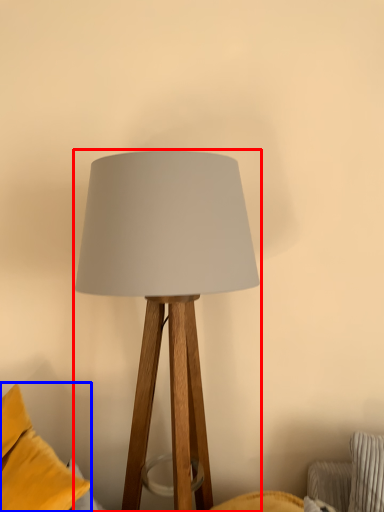
Question: Which object is closer to the camera taking this photo, lamp (highlighted by a red box) or pillow (highlighted by a blue box)?

Choices:
 (A) lamp
 (B) pillow

Answer: (B)